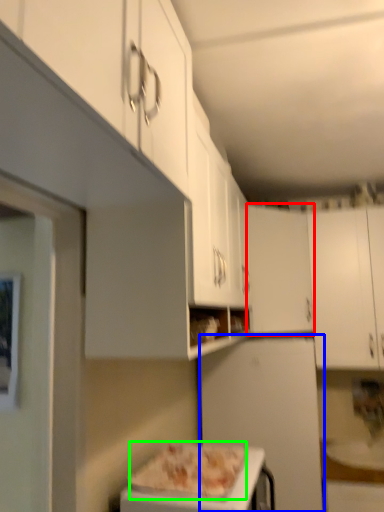
Question: Estimate the real-world distances between objects in this image. Which object is closer to cabinetry (highlighted by a red box), appliance (highlighted by a blue box) or pizza (highlighted by a green box)?

Choices:
 (A) appliance
 (B) pizza

Answer: (A)